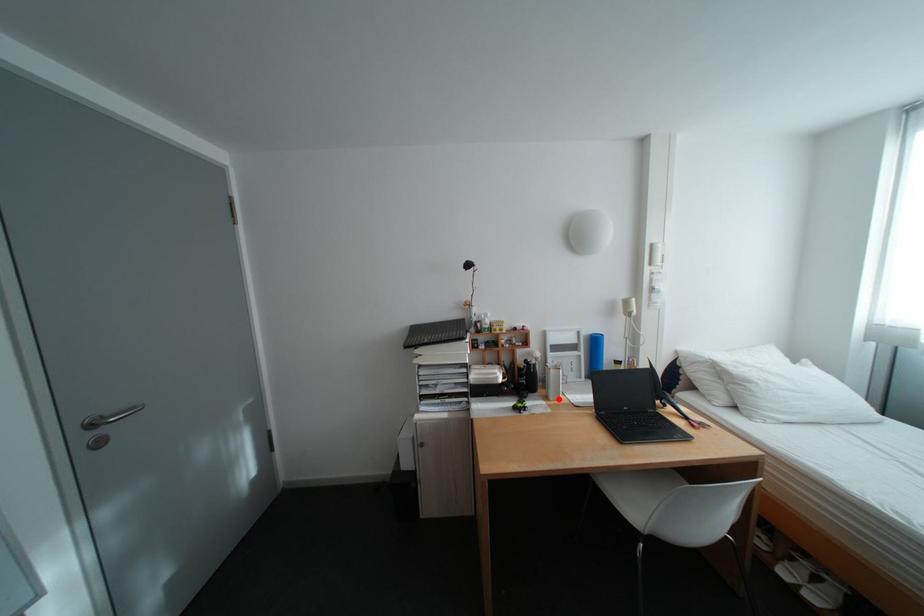
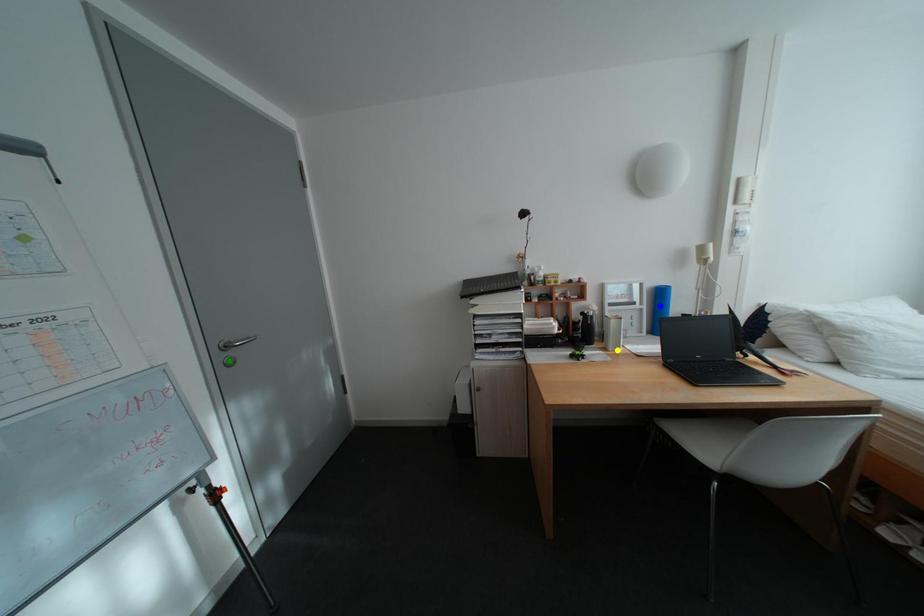
Question: I am providing you with two images of the same scene from different viewpoints. A red point is marked on the first image. You are given multiple points on the second image. Which point in image 2 is actually the same real-world point as the red point in image 1?

Choices:
 (A) green point
 (B) yellow point
 (C) blue point

Answer: (B)